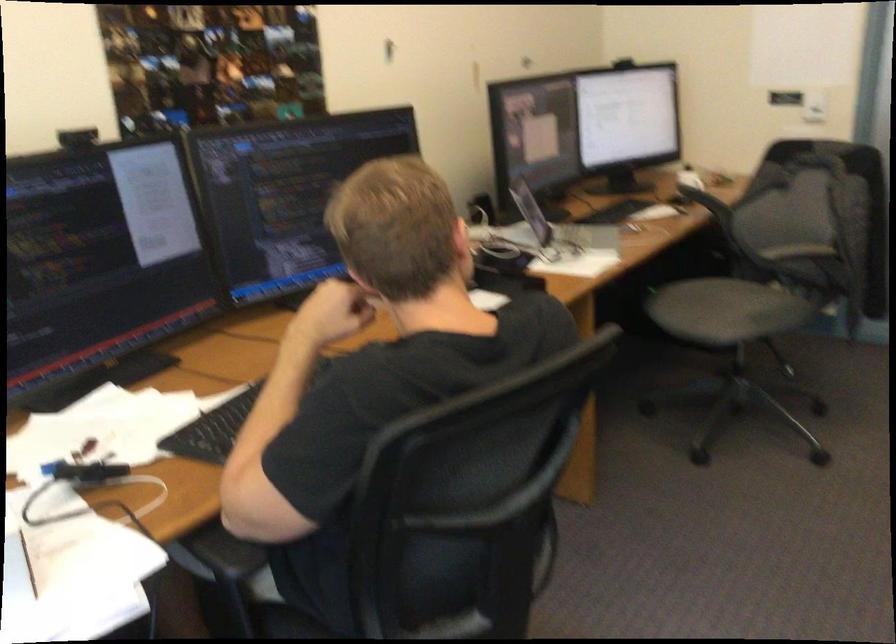
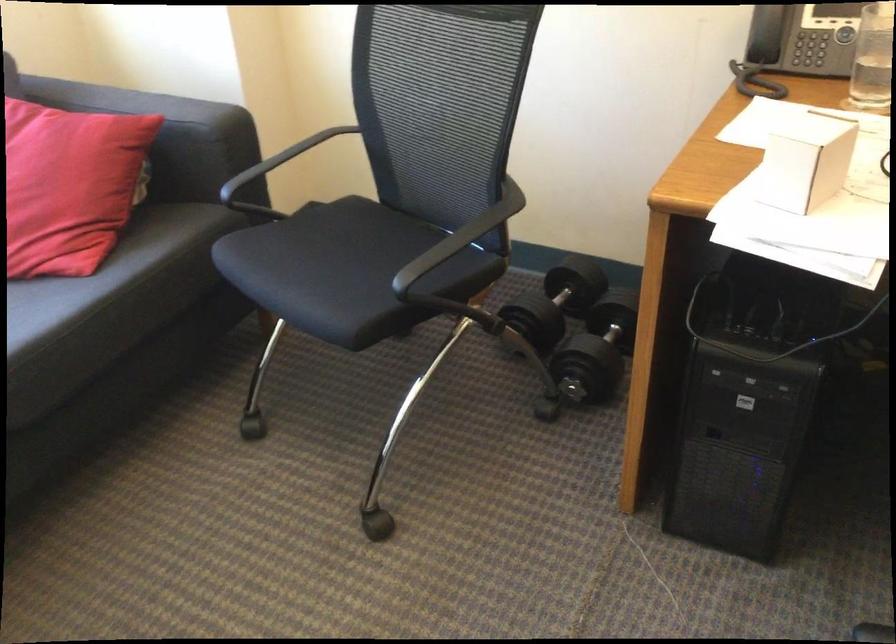
The first image is from the beginning of the video and the second image is from the end. How did the camera likely rotate when shooting the video?

The camera rotated toward left-down.